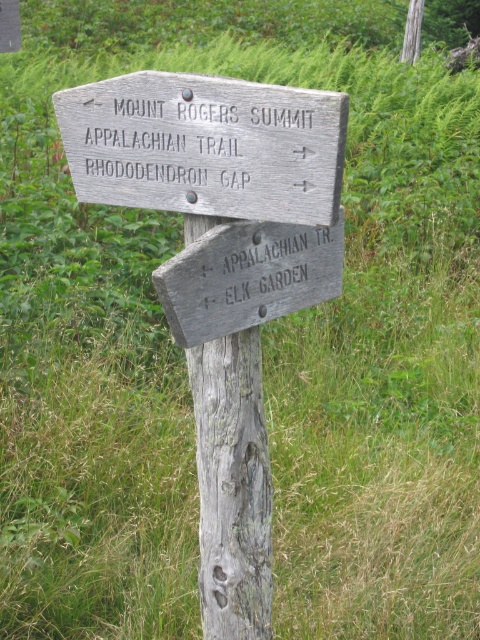
Which is above, weathered wood sign at upper center or weathered wood post at center?

weathered wood sign at upper center is higher up.

Does point (290, 129) lie in front of point (200, 563)?

Yes, it is in front of point (200, 563).

Does point (199, 93) come farther from viewer compared to point (194, 380)?

No, (199, 93) is in front of (194, 380).

Where is `weathered wood sign at upper center`? weathered wood sign at upper center is located at coordinates (205, 145).

Who is more distant from viewer, (x=252, y=580) or (x=278, y=269)?

The point (x=252, y=580) is more distant.

Does point (203, 620) come behind point (253, 307)?

Yes, point (203, 620) is farther from viewer.

This screenshot has width=480, height=640. What do you see at coordinates (232, 486) in the screenshot?
I see `weathered wood post at center` at bounding box center [232, 486].

Locate an element on the screen. weathered wood post at center is located at coordinates tap(232, 486).

Between weathered wood signpost at center and weathered wood post at center, which one is positioned lower?

weathered wood post at center

Does weathered wood signpost at center lie behind weathered wood post at center?

No, it is not.

Where is `weathered wood signpost at center`? The image size is (480, 640). weathered wood signpost at center is located at coordinates (223, 273).

Locate an element on the screen. This screenshot has height=640, width=480. weathered wood signpost at center is located at coordinates (223, 273).